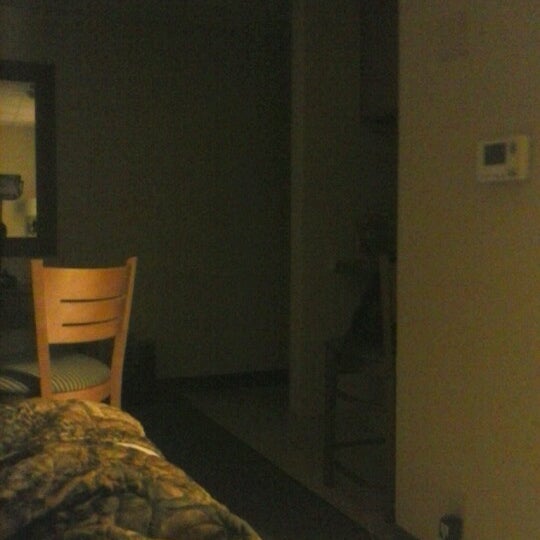
Find the location of a particular element. veneered wood is located at coordinates (68, 298), (57, 333), (120, 327).